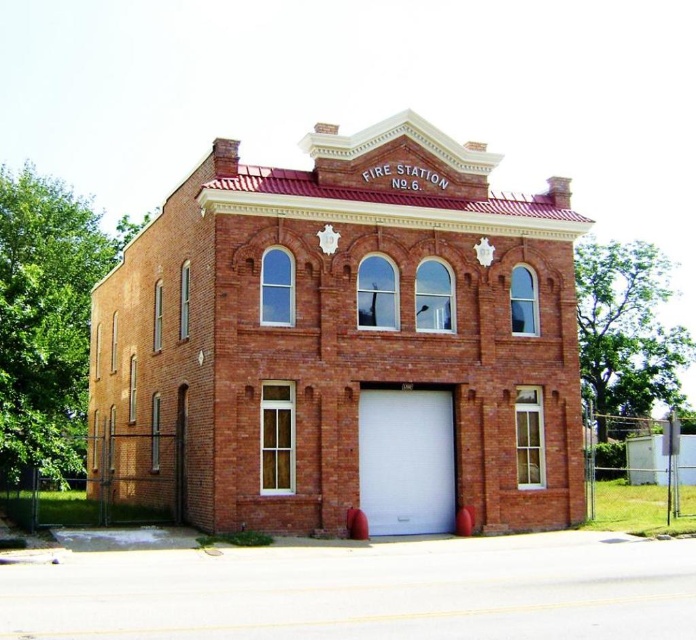
Is point (171, 308) closer to viewer compared to point (381, 420)?

No, it is behind (381, 420).

Measure the distance between red brick fire station at center and white matte garage door at center.

A distance of 8.35 meters exists between red brick fire station at center and white matte garage door at center.

Find the location of `red brick fire station at center`. red brick fire station at center is located at coordinates (345, 342).